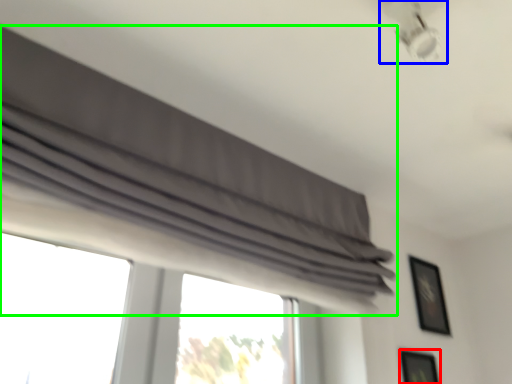
Question: Which object is the closest to the picture frame (highlighted by a red box)? Choose among these: lamp (highlighted by a blue box) or curtain (highlighted by a green box).

Choices:
 (A) lamp
 (B) curtain

Answer: (B)